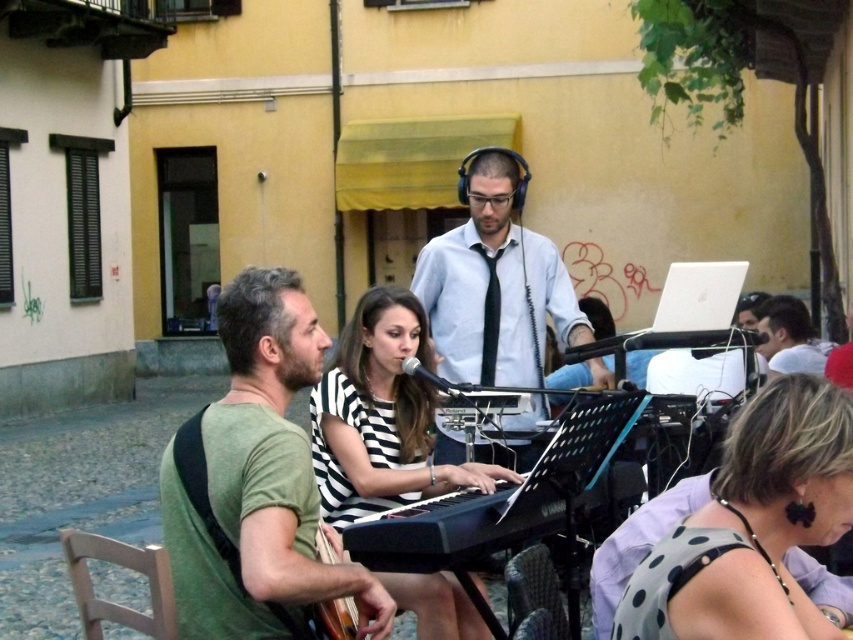
In the scene shown: Is green cotton shirt at center positioned at the back of wooden chair at lower left?

That is False.

Consider the image. Can you confirm if green cotton shirt at center is positioned to the left of wooden chair at lower left?

In fact, green cotton shirt at center is to the right of wooden chair at lower left.

Describe the element at coordinates (254, 483) in the screenshot. I see `green cotton shirt at center` at that location.

Locate an element on the screen. The width and height of the screenshot is (853, 640). green cotton shirt at center is located at coordinates (254, 483).

Is point (416, 545) farther from viewer compared to point (807, 321)?

No, it is in front of (807, 321).

This screenshot has height=640, width=853. Describe the element at coordinates (498, 499) in the screenshot. I see `black plastic keyboard at center` at that location.

Does point (426, 499) come closer to viewer compared to point (779, 336)?

That is True.

Identify the location of black plastic keyboard at center. The width and height of the screenshot is (853, 640). (498, 499).

Is light blue shirt at center to the left of wooden acoustic guitar at lower left from the viewer's perspective?

In fact, light blue shirt at center is to the right of wooden acoustic guitar at lower left.

Does point (517, 228) lie behind point (334, 611)?

Yes.

Measure the distance between point [491,358] and camera.

A distance of 5.85 meters exists between point [491,358] and camera.

I want to click on light blue shirt at center, so pos(494,282).